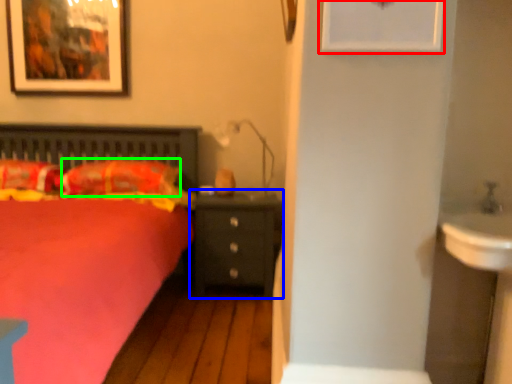
Question: Which is nearer to the picture frame (highlighted by a red box)? nightstand (highlighted by a blue box) or pillow (highlighted by a green box).

Choices:
 (A) nightstand
 (B) pillow

Answer: (A)